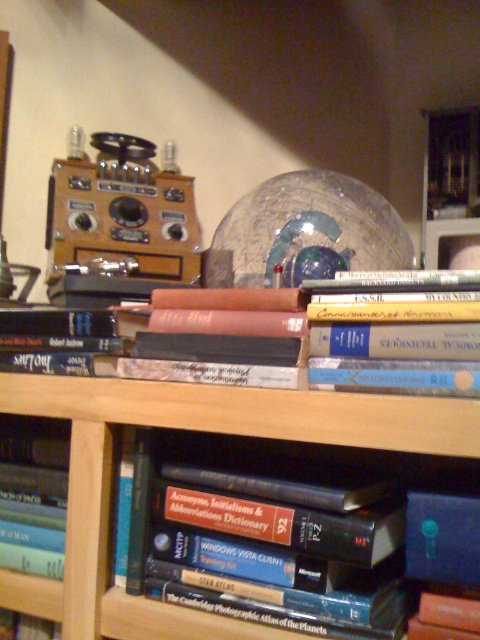
Question: Does hardcover book at center appear on the left side of blue hardcover book at lower left?

Choices:
 (A) no
 (B) yes

Answer: (A)

Question: Is hardcover book at center to the left of blue hardcover book at lower left from the viewer's perspective?

Choices:
 (A) yes
 (B) no

Answer: (B)

Question: Which point is farther from the camera taking this photo?

Choices:
 (A) (385, 285)
 (B) (58, 500)
 (C) (242, 634)

Answer: (B)

Question: Can you confirm if hardcover books at center is positioned to the right of blue hardcover book at lower left?

Choices:
 (A) no
 (B) yes

Answer: (B)

Question: Which object is the farthest from the blue hardcover book at lower left?

Choices:
 (A) hardcover book at center
 (B) hardcover books at center

Answer: (A)

Question: Considering the real-world distances, which object is farthest from the blue hardcover book at lower left?

Choices:
 (A) hardcover book at center
 (B) hardcover books at center

Answer: (A)